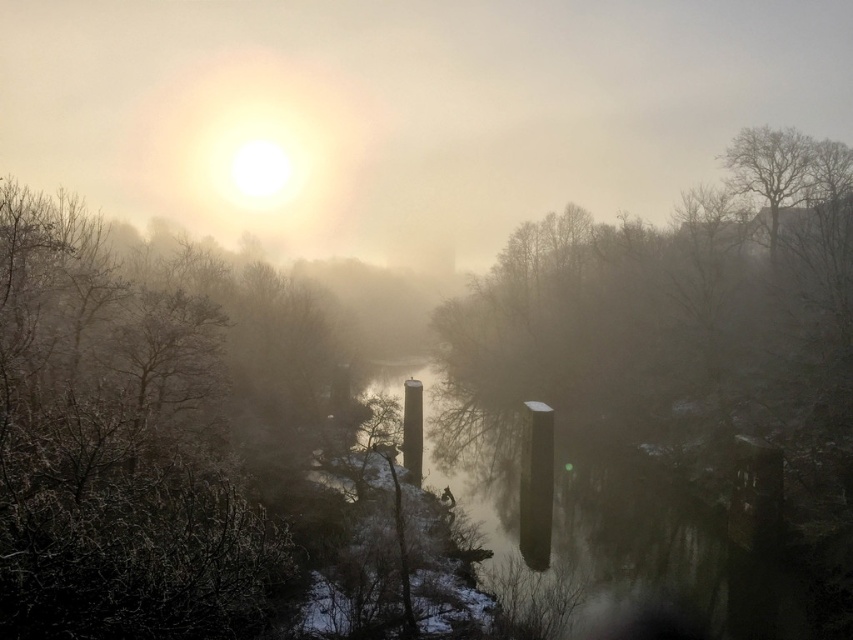
Question: Among these points, which one is nearest to the camera?

Choices:
 (A) (722, 593)
 (B) (633, 401)
 (C) (167, 461)

Answer: (C)

Question: Does smooth bark tree at center lie in front of smooth concrete pillars at center?

Choices:
 (A) no
 (B) yes

Answer: (A)

Question: Can you confirm if frosted brown tree at upper left is thinner than smooth bark tree at center?

Choices:
 (A) yes
 (B) no

Answer: (A)

Question: Which of the following is the farthest from the observer?

Choices:
 (A) (637, 376)
 (B) (54, 636)

Answer: (A)

Question: Which object is farther from the camera taking this photo?

Choices:
 (A) smooth concrete pillars at center
 (B) frosted brown tree at upper left
 (C) smooth bark tree at center

Answer: (C)

Question: Is frosted brown tree at upper left behind smooth concrete pillars at center?

Choices:
 (A) yes
 (B) no

Answer: (B)